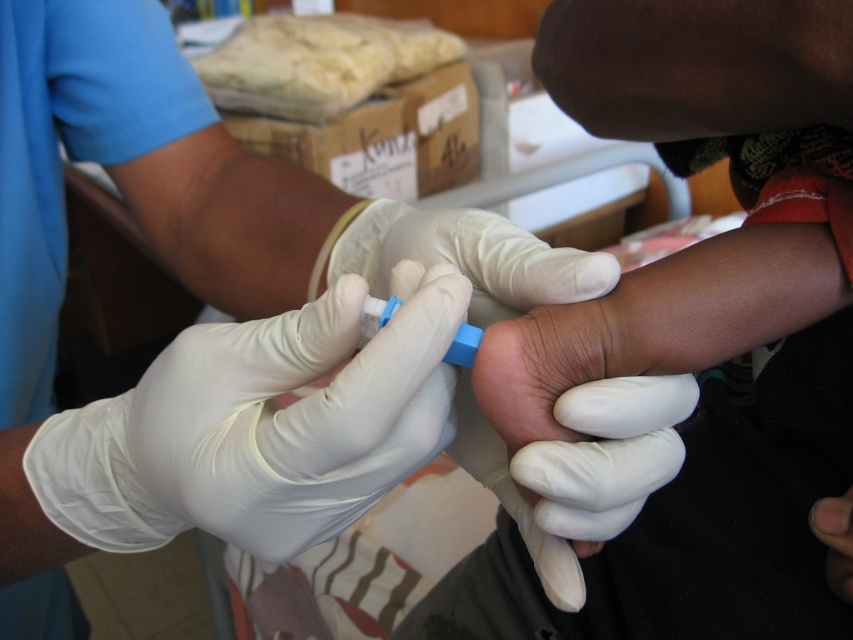
Question: Among these objects, which one is nearest to the camera?

Choices:
 (A) white latex glove at center
 (B) white rubber glove at center
 (C) white latex gloves at center
 (D) blue plastic syringe at center

Answer: (A)

Question: Among these points, which one is nearest to the camera?

Choices:
 (A) (326, 483)
 (B) (556, 272)

Answer: (A)

Question: Is white latex gloves at center above white rubber glove at center?

Choices:
 (A) yes
 (B) no

Answer: (B)

Question: Does white latex glove at center appear under white rubber glove at center?

Choices:
 (A) no
 (B) yes

Answer: (B)

Question: Which object is the farthest from the white rubber glove at center?

Choices:
 (A) white latex gloves at center
 (B) blue plastic syringe at center

Answer: (A)

Question: Does white latex glove at center have a greater width compared to blue plastic syringe at center?

Choices:
 (A) yes
 (B) no

Answer: (A)